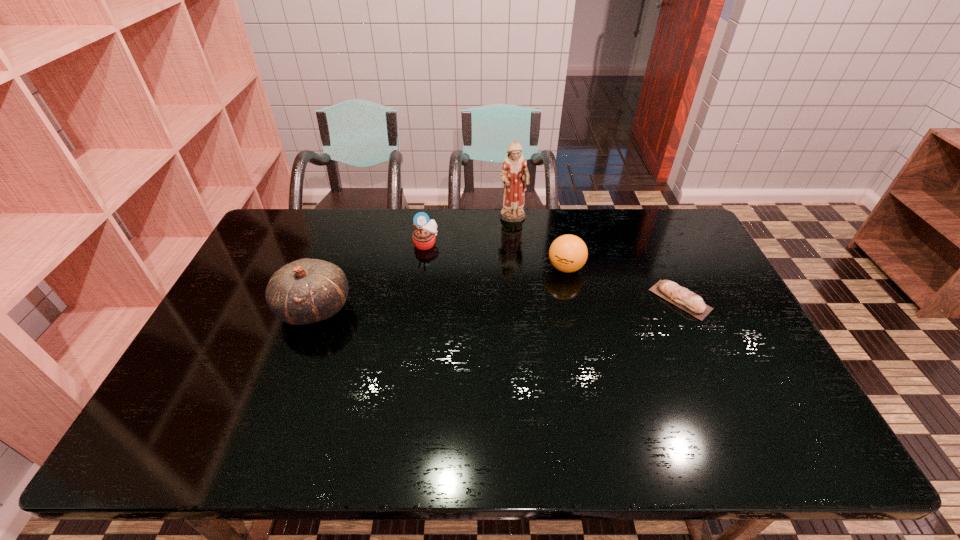
The height and width of the screenshot is (540, 960). Find the location of `vacant space positioned on the back of the rightmost object`. vacant space positioned on the back of the rightmost object is located at coordinates (649, 232).

This screenshot has width=960, height=540. Find the location of `vacant space located 0.190m on the side with brand of the fourth object from left to right`. vacant space located 0.190m on the side with brand of the fourth object from left to right is located at coordinates (516, 309).

The height and width of the screenshot is (540, 960). What are the coordinates of `blank area located 0.360m on the side with brand of the fourth object from left to right` in the screenshot? It's located at (474, 342).

Identify the location of free space located 0.320m on the side with brand of the fourth object from left to right. This screenshot has height=540, width=960. (485, 333).

Find the location of a particular element. Image resolution: width=960 pixels, height=540 pixels. vacant space located 0.060m on the front-facing side of the muffin is located at coordinates (438, 261).

Where is `free region located 0.070m on the front-facing side of the muffin`? The height and width of the screenshot is (540, 960). free region located 0.070m on the front-facing side of the muffin is located at coordinates (440, 263).

This screenshot has width=960, height=540. I want to click on free space located on the front-facing side of the muffin, so click(447, 274).

Find the location of a particular element. The image size is (960, 540). vacant position located 0.250m on the front-facing side of the third object from right to left is located at coordinates (537, 273).

The height and width of the screenshot is (540, 960). I want to click on vacant space located on the front-facing side of the third object from right to left, so click(538, 274).

You are a GUI agent. You are given a task and a screenshot of the screen. Output one action in this format:
    pyautogui.click(x=<x>, y=<y>)
    Task: Click on the blank space located 0.120m on the front-facing side of the third object from right to left
    
    Given the screenshot: What is the action you would take?
    pyautogui.click(x=525, y=247)